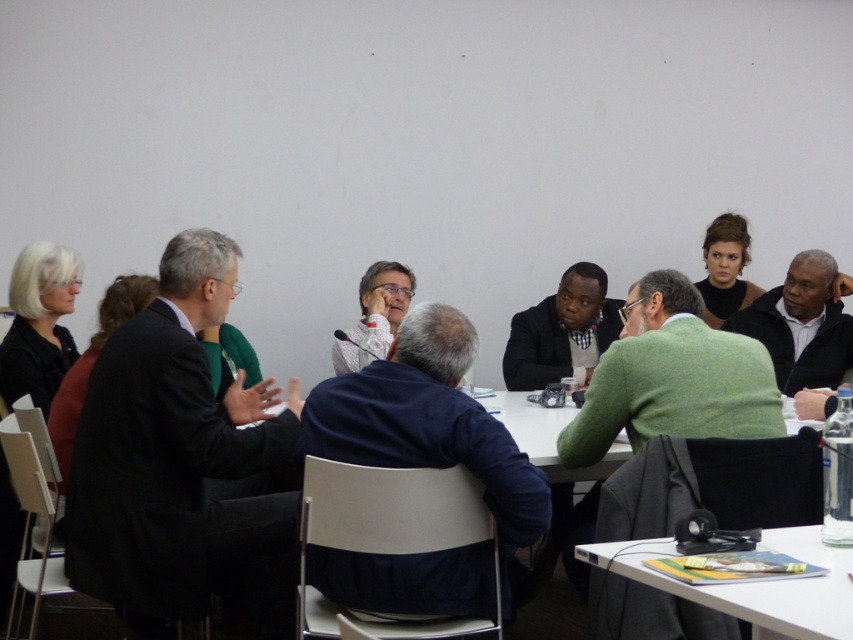
Question: Which of these objects is positioned closest to the white plastic table at lower right?

Choices:
 (A) black suit at left
 (B) white shirt at center

Answer: (A)

Question: Does black suit at left appear under white plastic table at lower right?

Choices:
 (A) no
 (B) yes

Answer: (A)

Question: Based on their relative distances, which object is nearer to the white shirt at center?

Choices:
 (A) white plastic table at lower right
 (B) black suit at left

Answer: (B)

Question: Is black suit at left bigger than white plastic table at lower right?

Choices:
 (A) yes
 (B) no

Answer: (A)

Question: Is black suit at left below white shirt at center?

Choices:
 (A) yes
 (B) no

Answer: (A)

Question: Estimate the real-world distances between objects in this image. Which object is closer to the white shirt at center?

Choices:
 (A) black suit at left
 (B) white plastic table at lower right

Answer: (A)